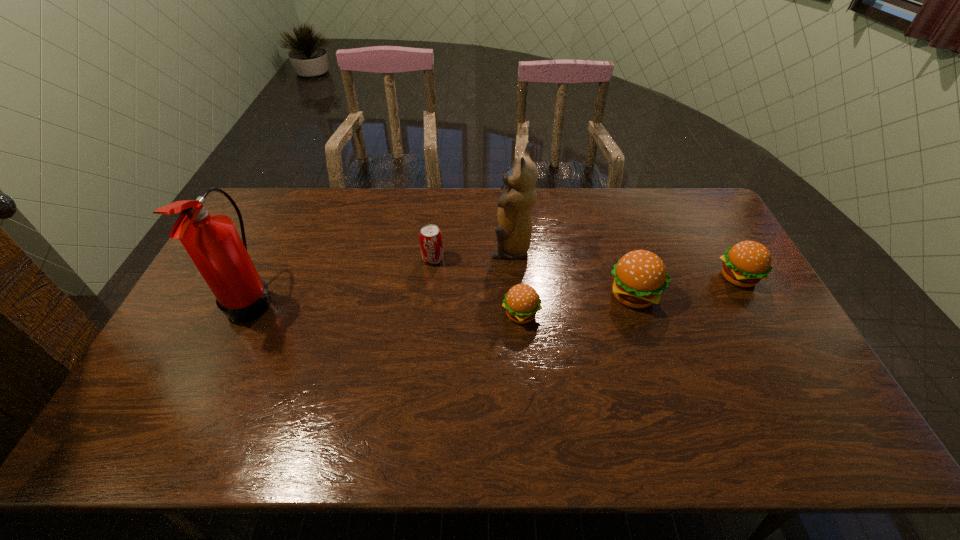
The height and width of the screenshot is (540, 960). Find the location of `free space that satisfies the following two spatial constraints: 1. at the spray nozzle of the leftmost hamburger; 2. on the left side of the fire extinguisher`. free space that satisfies the following two spatial constraints: 1. at the spray nozzle of the leftmost hamburger; 2. on the left side of the fire extinguisher is located at coordinates (245, 314).

Locate an element on the screen. blank space that satisfies the following two spatial constraints: 1. on the back side of the rightmost object; 2. on the face of the cat is located at coordinates (721, 248).

Find the location of a particular element. The image size is (960, 540). vacant point that satisfies the following two spatial constraints: 1. on the face of the cat; 2. on the right side of the second object from right to left is located at coordinates (515, 295).

The height and width of the screenshot is (540, 960). What are the coordinates of `vacant space that satisfies the following two spatial constraints: 1. on the front side of the leftmost hamburger; 2. on the left side of the second object from left to right` in the screenshot? It's located at (427, 314).